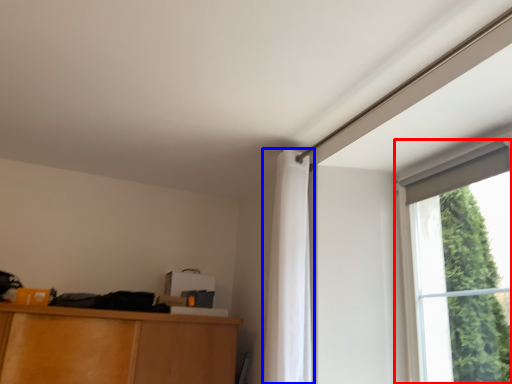
Question: Among these objects, which one is farthest to the camera, window (highlighted by a red box) or curtain (highlighted by a blue box)?

Choices:
 (A) window
 (B) curtain

Answer: (B)